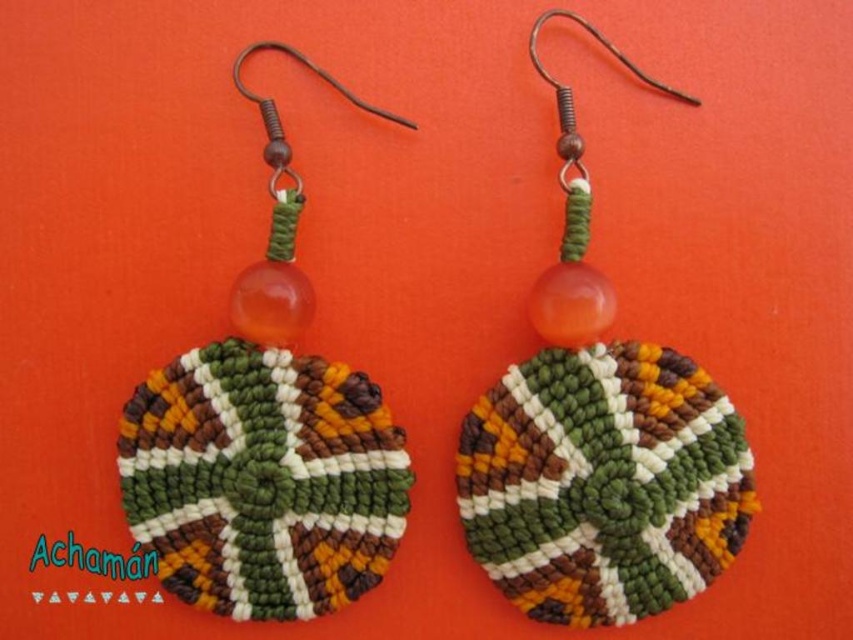
You are an artisan examining two earrings. You notice the multicolored woven disc at center and the matte woven disc at center. Which of these has a greater width?

The multicolored woven disc at center has a greater width than the matte woven disc at center according to the description.

Based on the photo, you are an artisan examining the earrings and notice two discs at the center. Which disc is closer to you, the multicolored woven disc at center or the matte woven disc at center?

The multicolored woven disc at center is closer to you because the matte woven disc at center is positioned behind it.